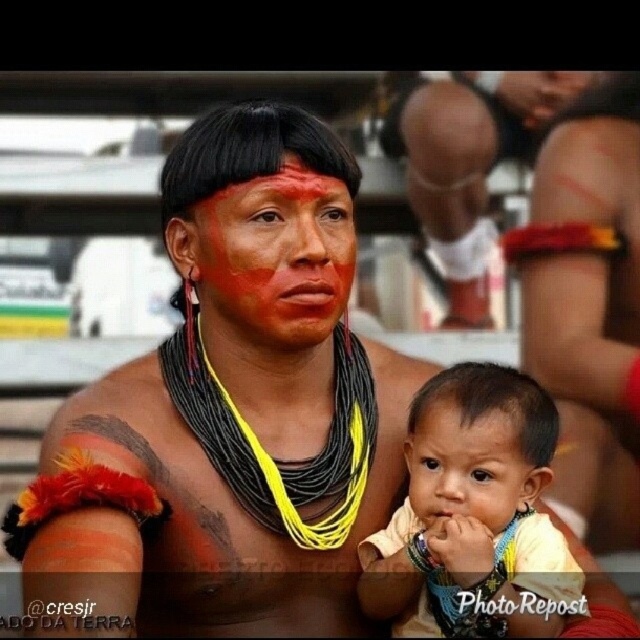
Is matte red face paint at center above matte orange forehead at center?

Yes, matte red face paint at center is above matte orange forehead at center.

Looking at this image, can you confirm if matte red face paint at center is smaller than matte orange forehead at center?

Actually, matte red face paint at center might be larger than matte orange forehead at center.

Is point (298, 234) positioned behind point (461, 412)?

That is True.

Image resolution: width=640 pixels, height=640 pixels. What are the coordinates of `matte red face paint at center` in the screenshot? It's located at (275, 256).

I want to click on smooth skin baby at center, so click(467, 467).

Find the location of a particular element. The image size is (640, 640). smooth skin baby at center is located at coordinates (467, 467).

Who is positioned more to the right, matte black necklace at center or matte red face paint at center?

matte black necklace at center

Which is in front, point (605, 120) or point (227, 225)?

Point (227, 225)

The image size is (640, 640). What do you see at coordinates (588, 305) in the screenshot?
I see `matte black necklace at center` at bounding box center [588, 305].

I want to click on matte black necklace at center, so click(x=588, y=305).